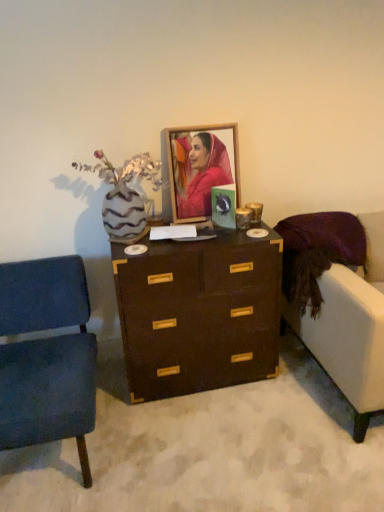
I want to click on vacant space situated above brown wood chest of drawers at center (from a real-world perspective), so click(x=191, y=231).